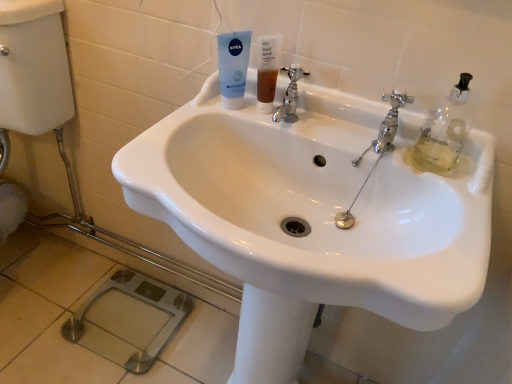
Locate an element on the screen. Image resolution: width=512 pixels, height=384 pixels. chrome metallic faucet at center, which is the 2th tap in right-to-left order is located at coordinates (290, 95).

Is point (292, 87) behind point (371, 147)?

Yes.

Considering the relative sizes of chrome metallic faucet at center, which ranks as the 1th tap in left-to-right order, and chrome metallic faucet at upper right, which ranks as the 2th tap in left-to-right order, in the image provided, is chrome metallic faucet at center, which ranks as the 1th tap in left-to-right order, taller than chrome metallic faucet at upper right, which ranks as the 2th tap in left-to-right order,?

In fact, chrome metallic faucet at center, which ranks as the 1th tap in left-to-right order, may be shorter than chrome metallic faucet at upper right, which ranks as the 2th tap in left-to-right order.

Measure the distance from chrome metallic faucet at center, which ranks as the 1th tap in left-to-right order, to chrome metallic faucet at upper right, the first tap from the right.

chrome metallic faucet at center, which ranks as the 1th tap in left-to-right order, and chrome metallic faucet at upper right, the first tap from the right, are 17.82 centimeters apart from each other.

The image size is (512, 384). In order to click on tap above the chrome metallic faucet at upper right, which ranks as the 2th tap in left-to-right order (from the image's perspective) in this screenshot , I will do `click(290, 95)`.

Is chrome metallic faucet at upper right, the first tap from the right, in front of or behind chrome metallic faucet at center, which ranks as the 1th tap in left-to-right order, in the image?

In the image, chrome metallic faucet at upper right, the first tap from the right, appears in front of chrome metallic faucet at center, which ranks as the 1th tap in left-to-right order.

Is chrome metallic faucet at upper right, which ranks as the 2th tap in left-to-right order, not near chrome metallic faucet at center, which ranks as the 1th tap in left-to-right order?

No, chrome metallic faucet at upper right, which ranks as the 2th tap in left-to-right order, is not far away from chrome metallic faucet at center, which ranks as the 1th tap in left-to-right order.

Considering the sizes of objects chrome metallic faucet at upper right, which ranks as the 2th tap in left-to-right order, and chrome metallic faucet at center, which is the 2th tap in right-to-left order, in the image provided, who is smaller, chrome metallic faucet at upper right, which ranks as the 2th tap in left-to-right order, or chrome metallic faucet at center, which is the 2th tap in right-to-left order,?

chrome metallic faucet at upper right, which ranks as the 2th tap in left-to-right order.

From the image's perspective, is chrome metallic faucet at upper right, the first tap from the right, located above or below chrome metallic faucet at center, which is the 2th tap in right-to-left order?

From the image's perspective, chrome metallic faucet at upper right, the first tap from the right, appears below chrome metallic faucet at center, which is the 2th tap in right-to-left order.

Which point is more forward, [225,90] or [266,101]?

The point [225,90] is closer to the camera.

Which object is thinner, blue matte tube at upper center or translucent amber liquid at sink center?

Thinner between the two is translucent amber liquid at sink center.

Does blue matte tube at upper center have a smaller size compared to translucent amber liquid at sink center?

Incorrect, blue matte tube at upper center is not smaller in size than translucent amber liquid at sink center.

Who is taller, blue matte tube at upper center or translucent amber liquid at sink center?

With more height is blue matte tube at upper center.

Is white glossy sink at center closer to camera compared to chrome metallic faucet at center, which is the 2th tap in right-to-left order?

Yes, white glossy sink at center is closer to the camera.

Looking at their sizes, would you say white glossy sink at center is wider or thinner than chrome metallic faucet at center, which ranks as the 1th tap in left-to-right order?

In the image, white glossy sink at center appears to be wider than chrome metallic faucet at center, which ranks as the 1th tap in left-to-right order.

From the picture: From the image's perspective, who appears lower, white glossy sink at center or chrome metallic faucet at center, which ranks as the 1th tap in left-to-right order?

white glossy sink at center appears lower in the image.

Is chrome metallic faucet at center, which ranks as the 1th tap in left-to-right order, bigger than blue matte tube at upper center?

No, chrome metallic faucet at center, which ranks as the 1th tap in left-to-right order, is not bigger than blue matte tube at upper center.

Between chrome metallic faucet at center, which is the 2th tap in right-to-left order, and blue matte tube at upper center, which one has more height?

With more height is blue matte tube at upper center.

Which of these two, chrome metallic faucet at center, which is the 2th tap in right-to-left order, or blue matte tube at upper center, is wider?

blue matte tube at upper center is wider.

Between chrome metallic faucet at upper right, the first tap from the right, and translucent amber liquid at sink center, which one has larger size?

chrome metallic faucet at upper right, the first tap from the right.

Considering the positions of points (390, 139) and (267, 83), is point (390, 139) farther from camera compared to point (267, 83)?

No, it is in front of (267, 83).

How different are the orientations of chrome metallic faucet at upper right, which ranks as the 2th tap in left-to-right order, and translucent amber liquid at sink center in degrees?

3.7 degrees separate the facing orientations of chrome metallic faucet at upper right, which ranks as the 2th tap in left-to-right order, and translucent amber liquid at sink center.

Is chrome metallic faucet at upper right, the first tap from the right, positioned with its back to translucent amber liquid at sink center?

No, chrome metallic faucet at upper right, the first tap from the right,'s orientation is not away from translucent amber liquid at sink center.

Is chrome metallic faucet at upper right, the first tap from the right, located outside white glossy sink at center?

No, chrome metallic faucet at upper right, the first tap from the right, is not outside of white glossy sink at center.

From a real-world perspective, who is located higher, chrome metallic faucet at upper right, which ranks as the 2th tap in left-to-right order, or white glossy sink at center?

chrome metallic faucet at upper right, which ranks as the 2th tap in left-to-right order.

Between chrome metallic faucet at upper right, which ranks as the 2th tap in left-to-right order, and white glossy sink at center, which one appears on the left side from the viewer's perspective?

white glossy sink at center is more to the left.

Image resolution: width=512 pixels, height=384 pixels. I want to click on tap behind the chrome metallic faucet at upper right, which ranks as the 2th tap in left-to-right order, so click(x=290, y=95).

Locate an element on the screen. Image resolution: width=512 pixels, height=384 pixels. tap above the chrome metallic faucet at upper right, which ranks as the 2th tap in left-to-right order (from a real-world perspective) is located at coordinates (290, 95).

When comparing their distances from white glossy sink at center, does translucent amber liquid at sink center or chrome metallic faucet at center, which is the 2th tap in right-to-left order, seem further?

The object further to white glossy sink at center is translucent amber liquid at sink center.

Looking at the image, which one is located closer to chrome metallic faucet at center, which ranks as the 1th tap in left-to-right order, chrome metallic faucet at upper right, the first tap from the right, or translucent amber liquid at sink center?

A: Based on the image, translucent amber liquid at sink center appears to be nearer to chrome metallic faucet at center, which ranks as the 1th tap in left-to-right order.

Looking at the image, which one is located closer to chrome metallic faucet at upper right, the first tap from the right, chrome metallic faucet at center, which is the 2th tap in right-to-left order, or blue matte tube at upper center?

Based on the image, chrome metallic faucet at center, which is the 2th tap in right-to-left order, appears to be nearer to chrome metallic faucet at upper right, the first tap from the right.

When comparing their distances from white glossy sink at center, does translucent amber liquid at sink center or blue matte tube at upper center seem closer?

Among the two, blue matte tube at upper center is located nearer to white glossy sink at center.

Which object lies nearer to the anchor point chrome metallic faucet at center, which is the 2th tap in right-to-left order, white glossy sink at center or chrome metallic faucet at upper right, which ranks as the 2th tap in left-to-right order?

chrome metallic faucet at upper right, which ranks as the 2th tap in left-to-right order, lies closer to chrome metallic faucet at center, which is the 2th tap in right-to-left order, than the other object.

Considering their positions, is chrome metallic faucet at center, which ranks as the 1th tap in left-to-right order, positioned closer to white glossy sink at center than blue matte tube at upper center?

chrome metallic faucet at center, which ranks as the 1th tap in left-to-right order, lies closer to white glossy sink at center than the other object.

Estimate the real-world distances between objects in this image. Which object is further from blue matte tube at upper center, white glossy sink at center or chrome metallic faucet at upper right, the first tap from the right?

white glossy sink at center lies further to blue matte tube at upper center than the other object.

Based on their spatial positions, is white glossy sink at center or translucent amber liquid at sink center closer to blue matte tube at upper center?

translucent amber liquid at sink center is closer to blue matte tube at upper center.

At what (x,y) coordinates should I click in order to perform the action: click on liquid between blue matte tube at upper center and white glossy sink at center in the up-down direction. Please return your answer as a coordinate pair (x, y). Looking at the image, I should click on (266, 85).

You are a GUI agent. You are given a task and a screenshot of the screen. Output one action in this format:
    pyautogui.click(x=<x>, y=<y>)
    Task: Click on the tap between translucent amber liquid at sink center and chrome metallic faucet at upper right, which ranks as the 2th tap in left-to-right order
    The height and width of the screenshot is (384, 512).
    Given the screenshot: What is the action you would take?
    pyautogui.click(x=290, y=95)

You are a GUI agent. You are given a task and a screenshot of the screen. Output one action in this format:
    pyautogui.click(x=<x>, y=<y>)
    Task: Click on the liquid between blue matte tube at upper center and chrome metallic faucet at center, which is the 2th tap in right-to-left order, from left to right
    
    Given the screenshot: What is the action you would take?
    pyautogui.click(x=266, y=85)

The height and width of the screenshot is (384, 512). Identify the location of tap between chrome metallic faucet at center, which is the 2th tap in right-to-left order, and white glossy sink at center, in the vertical direction. (387, 124).